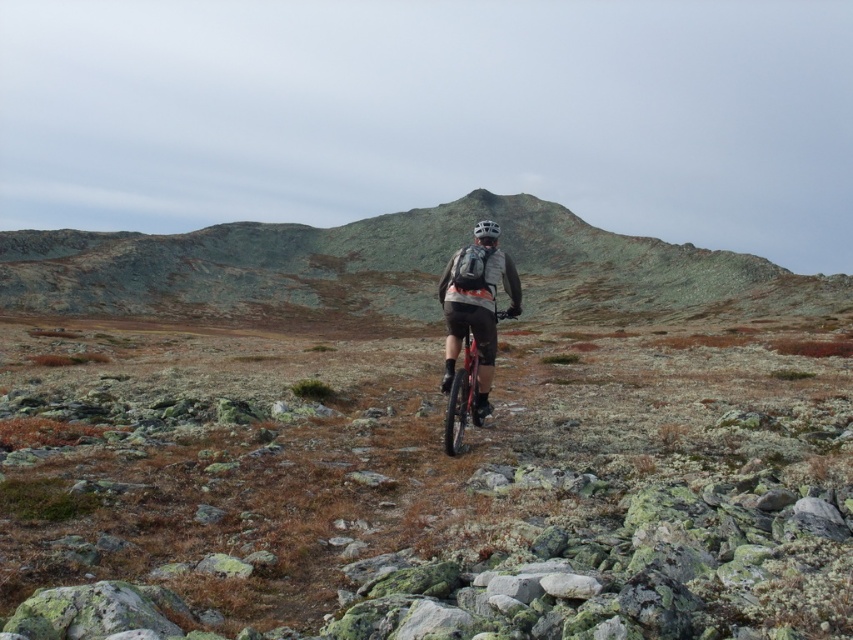
You are the mountain biker in the scene. Your GPS says you need to reach a checkpoint located exactly 200 feet ahead. Can you safely stop before the green mossy rock at center without overshooting the checkpoint?

The green mossy rock at center is 209.50 feet away from you. Since the checkpoint is 200 feet ahead, you can safely stop before reaching the rock and still be within the checkpoint distance.

You are the mountain biker in the image. You notice a green mossy rock at center and a silver metallic helmet at center. Which object is closer to you?

The silver metallic helmet at center is closer to you because it is positioned in front of the green mossy rock at center, which is further away.

You are a mountain biker navigating a rugged trail. You notice rough textured rocks at center. Based on their position, would you adjust your path to avoid them?

The rough textured rocks at center are located at point (426, 484), so yes, you should adjust your path to avoid them as they are centrally positioned in your path.